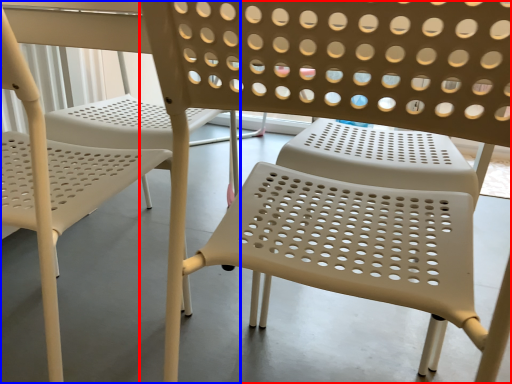
Question: Which object appears farthest to the camera in this image, chair (highlighted by a red box) or chair (highlighted by a blue box)?

Choices:
 (A) chair
 (B) chair

Answer: (B)